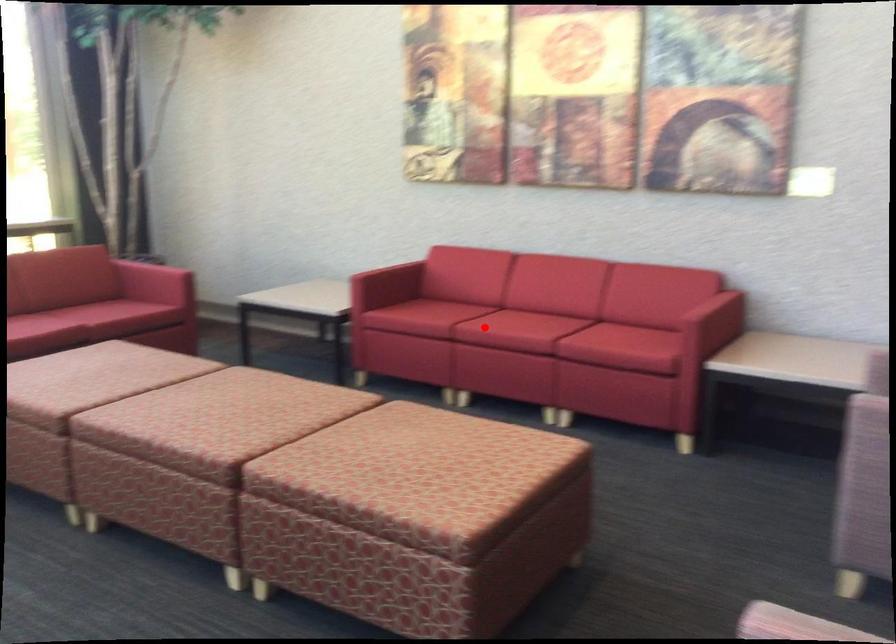
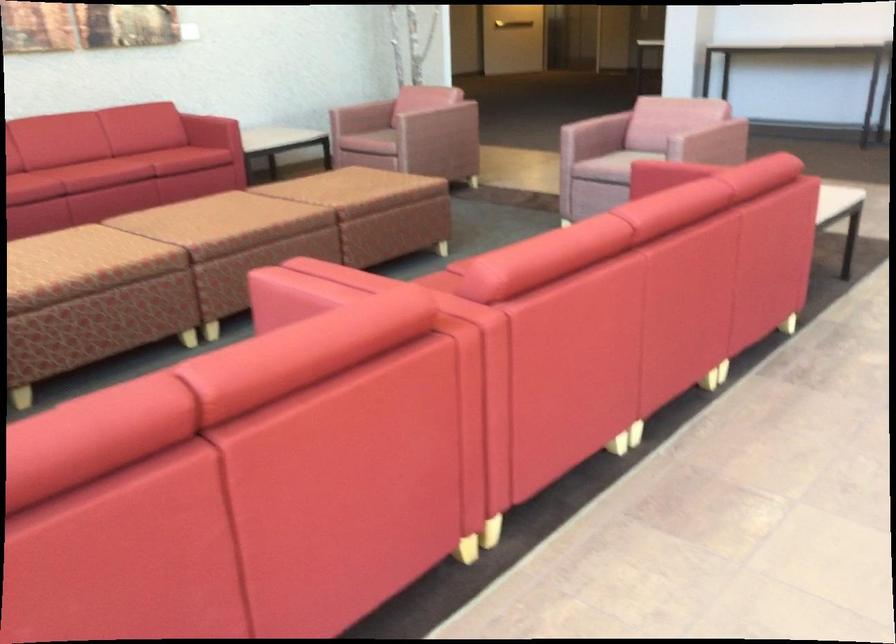
In the second image, find the point that corresponds to the highlighted location in the first image.

(142, 162)